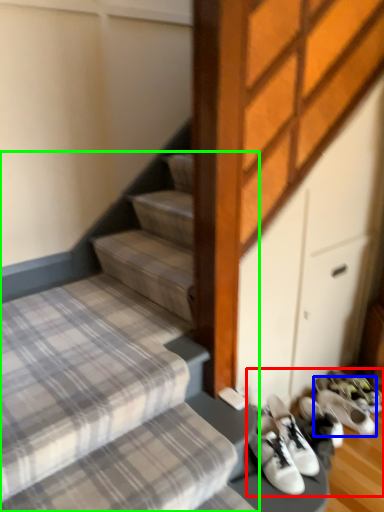
Question: Which object is the closest to the footwear (highlighted by a red box)? Choose among these: footwear (highlighted by a blue box) or stairs (highlighted by a green box).

Choices:
 (A) footwear
 (B) stairs

Answer: (A)